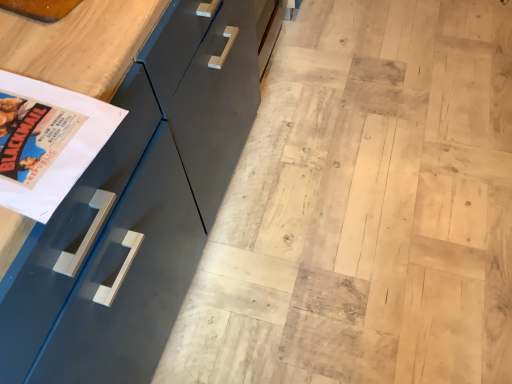
Where is `matte dark blue cabinet at left`? matte dark blue cabinet at left is located at coordinates (139, 206).

What is the approximate width of matte dark blue cabinet at left?

matte dark blue cabinet at left is 25.04 inches wide.

The image size is (512, 384). What do you see at coordinates (139, 206) in the screenshot? I see `matte dark blue cabinet at left` at bounding box center [139, 206].

Find the location of `matte dark blue cabinet at left`. matte dark blue cabinet at left is located at coordinates click(139, 206).